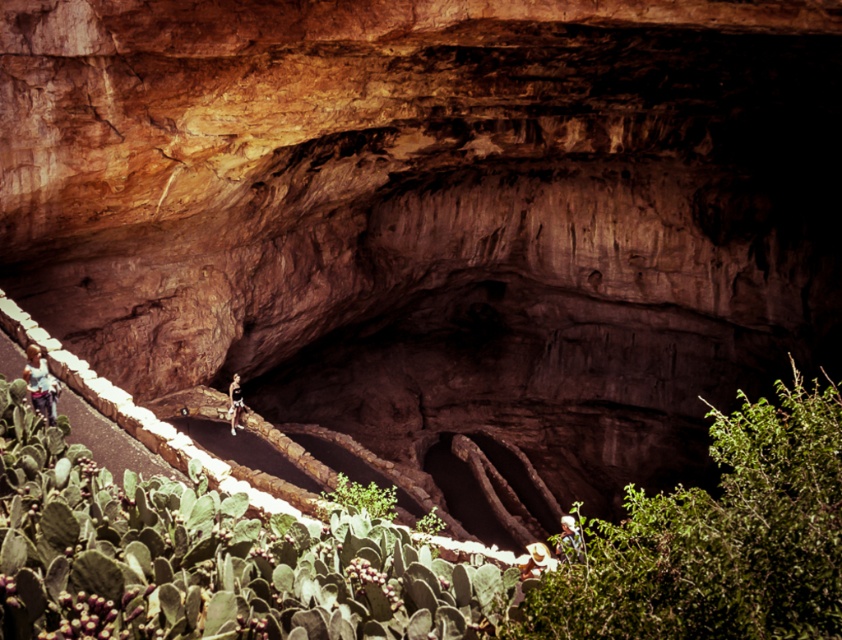
You are standing at the cave entrance and see a green leafy bush at lower right and a white fabric hat at lower center. Which object is positioned further to the right?

The green leafy bush at lower right is positioned further to the right compared to the white fabric hat at lower center.

You are standing at the cave entrance and see a green spiky cactus at lower left marked by point (205, 557). Which direction should you walk to avoid stepping on the cactus?

The green spiky cactus at lower left is located at point (205, 557). To avoid stepping on it, walk away from the direction of the cactus, which is to the right or upwards from the entrance.